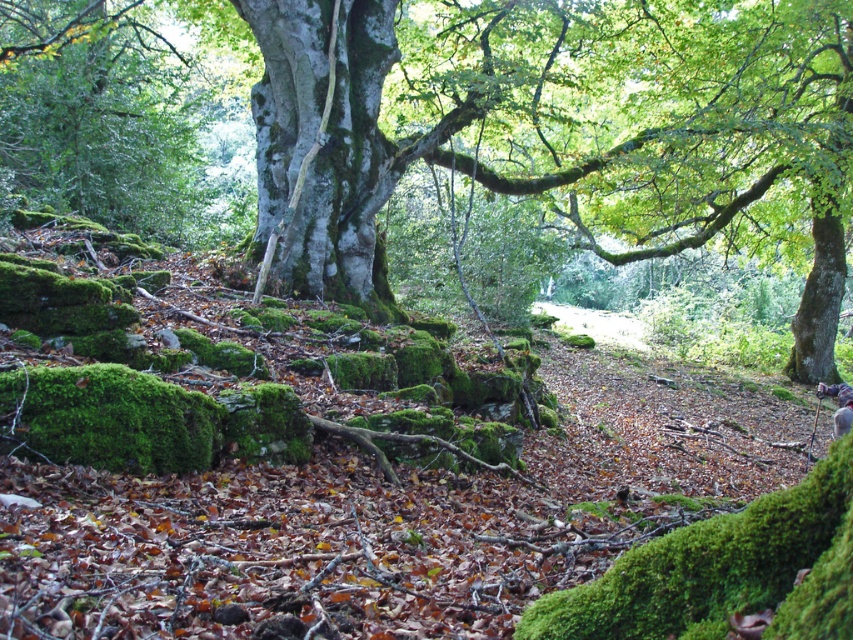
You are standing at the center of the forest and want to locate the green mossy tree at center. According to the coordinates provided, in which direction should you move relative to your current position?

The green mossy tree at center is located at coordinates point (592,129). Since you are at the center of the forest, you should move towards the direction of the coordinates to find it.

You are standing in the forest scene described. There is a point marked at coordinates (323, 141). What feature is located at that point?

The point at coordinates (323, 141) indicates smooth gray bark at center.

You are navigating through the forest and need to locate the green mossy tree at center. Based on the coordinates provided, can you determine its position relative to the center of the image?

The green mossy tree at center is located at point coordinates of 0.202 on the x axis and 0.695 on the y axis, which means it is positioned slightly to the left and lower than the exact center of the image.